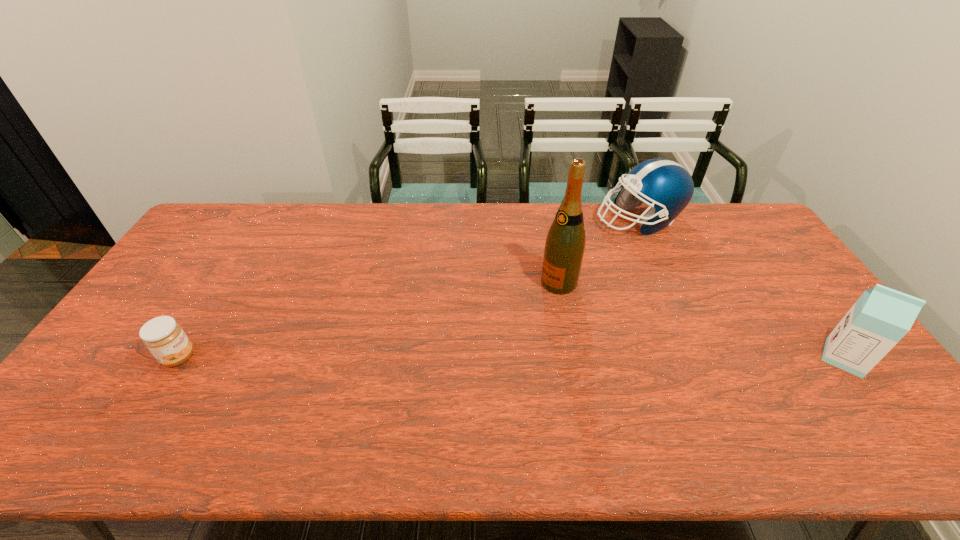
Where is `free space located 0.170m on the front-facing side of the tallest object`? The height and width of the screenshot is (540, 960). free space located 0.170m on the front-facing side of the tallest object is located at coordinates (506, 318).

Where is `vacant space located on the front-facing side of the tallest object`? vacant space located on the front-facing side of the tallest object is located at coordinates (468, 343).

The height and width of the screenshot is (540, 960). I want to click on free space located 0.060m at the front of the football helmet with the faceguard, so click(615, 246).

At what (x,y) coordinates should I click in order to perform the action: click on free location located at the front of the football helmet with the faceguard. Please return your answer as a coordinate pair (x, y). The height and width of the screenshot is (540, 960). Looking at the image, I should click on (581, 297).

The width and height of the screenshot is (960, 540). Identify the location of vacant area located at the front of the football helmet with the faceguard. (610, 254).

This screenshot has height=540, width=960. What are the coordinates of `object that is at the far edge` in the screenshot? It's located at (665, 185).

Locate an element on the screen. The height and width of the screenshot is (540, 960). object that is at the left edge is located at coordinates (163, 336).

This screenshot has height=540, width=960. In order to click on object at the right edge in this screenshot , I will do `click(881, 317)`.

Where is `free space at the far edge`? free space at the far edge is located at coordinates (342, 214).

I want to click on vacant area at the near edge, so click(x=790, y=401).